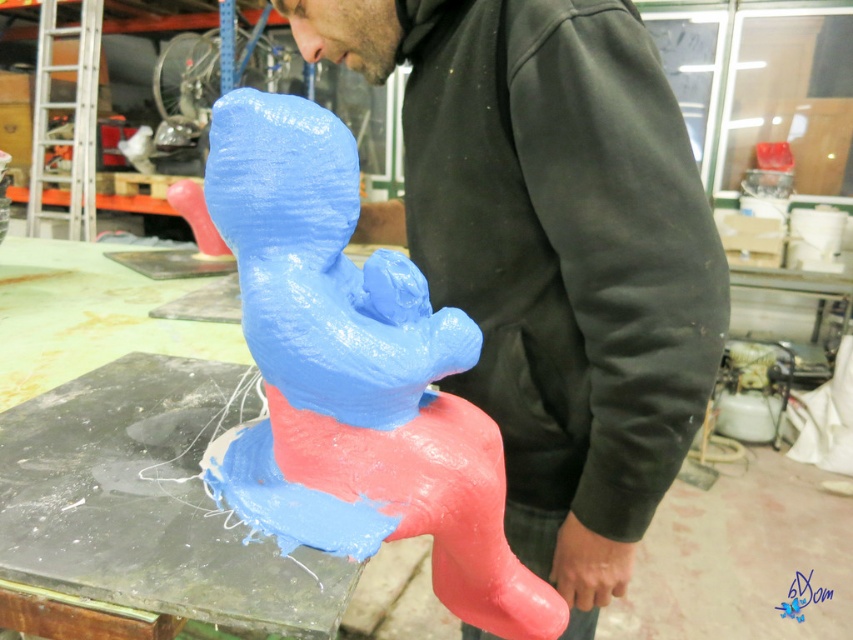
Which of these two, matte black hoodie at center or matte plastic toy at center, stands shorter?

With less height is matte plastic toy at center.

Is point (683, 243) less distant than point (311, 490)?

No, (683, 243) is behind (311, 490).

Is point (399, 38) positioned before point (302, 348)?

No, it is behind (302, 348).

The image size is (853, 640). Find the location of `matte black hoodie at center`. matte black hoodie at center is located at coordinates (552, 252).